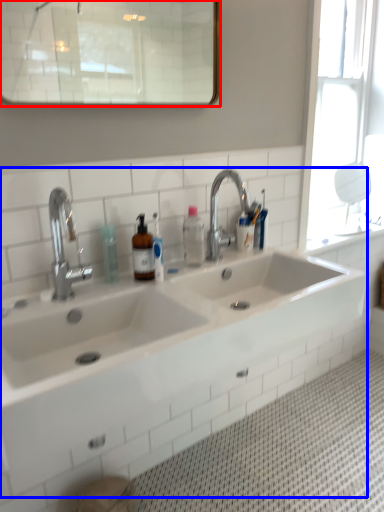
Question: Which point is further to the camera, mirror (highlighted by a red box) or sink (highlighted by a blue box)?

Choices:
 (A) mirror
 (B) sink

Answer: (A)